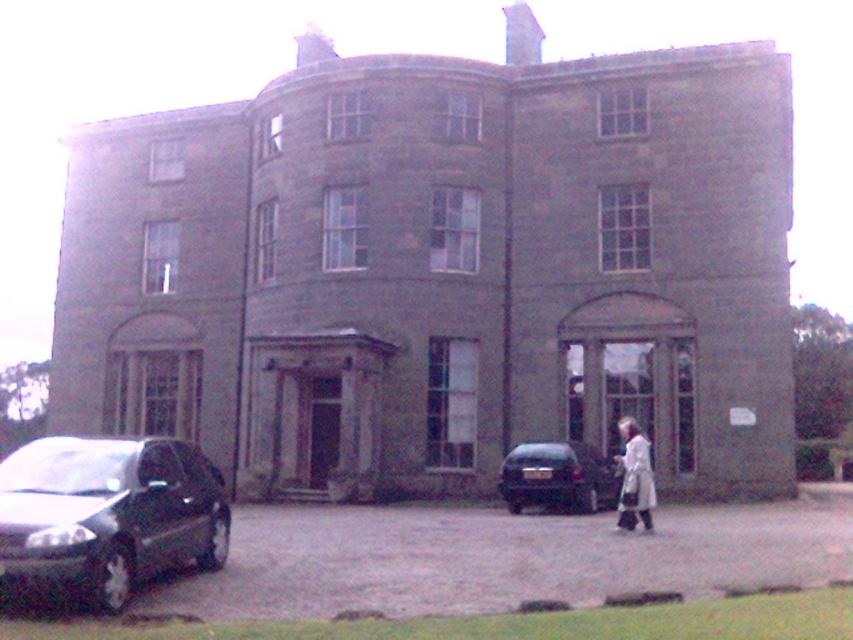
Can you confirm if shiny black car at lower left is positioned to the right of shiny black car at lower center?

Incorrect, shiny black car at lower left is not on the right side of shiny black car at lower center.

I want to click on shiny black car at lower left, so click(x=107, y=515).

Consider the image. Does gray asphalt driveway at lower center have a lesser width compared to shiny black car at lower left?

In fact, gray asphalt driveway at lower center might be wider than shiny black car at lower left.

Which is in front, point (804, 493) or point (119, 568)?

Positioned in front is point (119, 568).

Where is `gray asphalt driveway at lower center`? gray asphalt driveway at lower center is located at coordinates (502, 557).

Does shiny black car at lower center have a lesser height compared to white clothed figure at center?

Correct, shiny black car at lower center is not as tall as white clothed figure at center.

Can you confirm if shiny black car at lower center is bigger than white clothed figure at center?

Actually, shiny black car at lower center might be smaller than white clothed figure at center.

Does point (521, 481) come behind point (646, 506)?

That is True.

Where is `shiny black car at lower center`? The height and width of the screenshot is (640, 853). shiny black car at lower center is located at coordinates (558, 477).